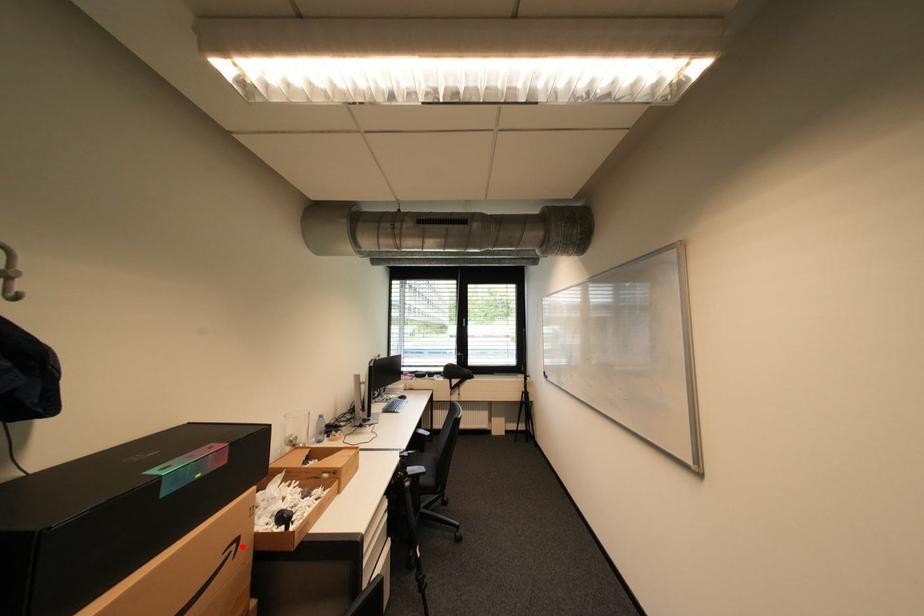
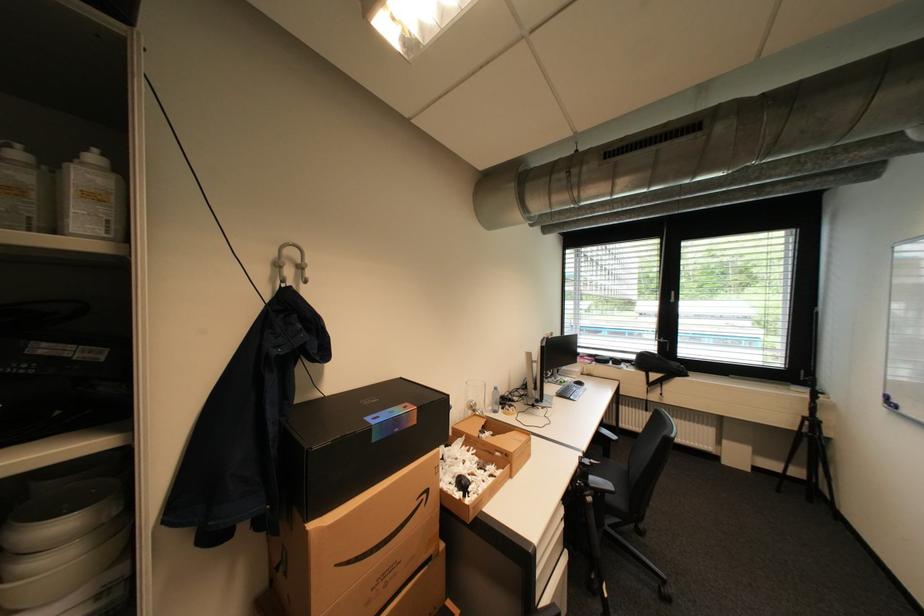
Where in the second image is the point corresponding to the highlighted location from the first image?

(433, 496)